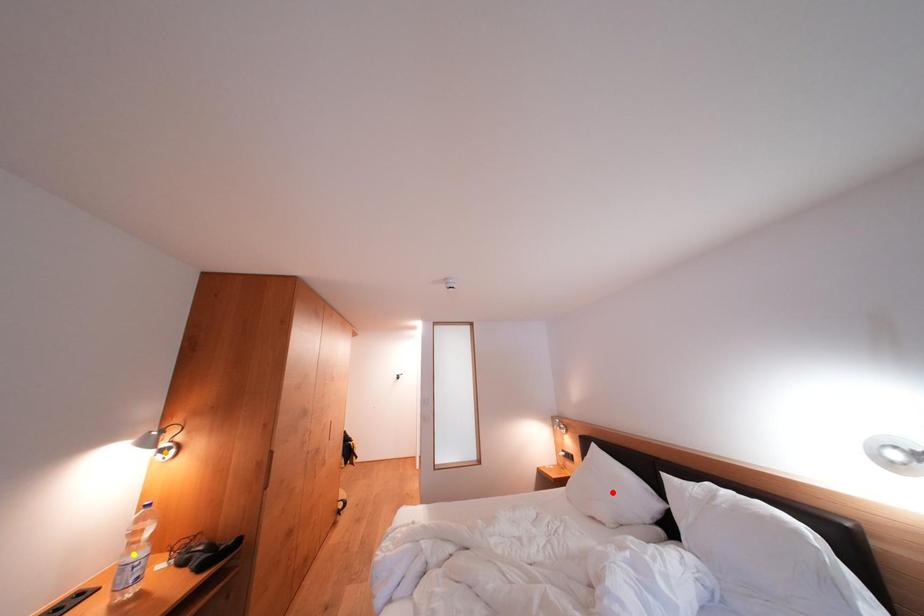
Order these from farthest to nearest:
A) yellow point
B) red point
C) orange point

1. red point
2. orange point
3. yellow point